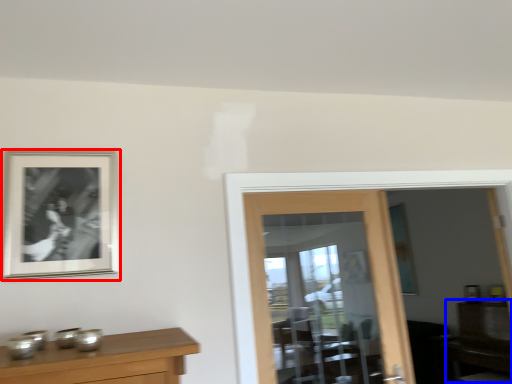
Question: Which object appears closest to the camera in this image, picture frame (highlighted by a red box) or dresser (highlighted by a blue box)?

Choices:
 (A) picture frame
 (B) dresser

Answer: (A)